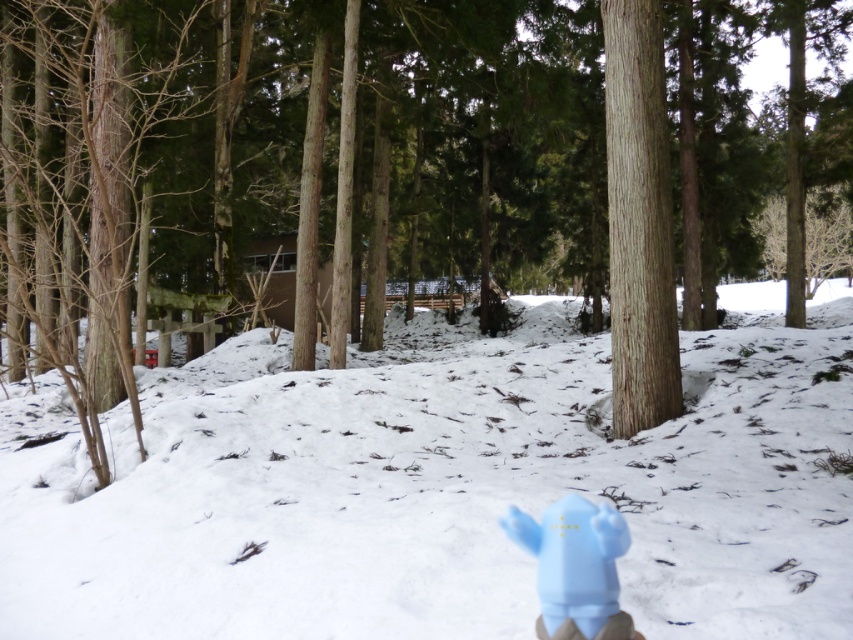
Question: Estimate the real-world distances between objects in this image. Which object is closer to the smooth brown tree trunk at center-right?

Choices:
 (A) white fluffy snow at center
 (B) light blue plastic toy at lower right

Answer: (A)

Question: Which point is farther to the camera?

Choices:
 (A) light blue plastic toy at lower right
 (B) smooth brown tree trunk at center-right
 (C) white fluffy snow at center

Answer: (B)

Question: Is smooth brown tree trunk at center-right thinner than light blue plastic toy at lower right?

Choices:
 (A) no
 (B) yes

Answer: (A)

Question: Is white fluffy snow at center thinner than smooth brown tree trunk at center-right?

Choices:
 (A) no
 (B) yes

Answer: (A)

Question: Which point appears closest to the camera in this image?

Choices:
 (A) (607, 51)
 (B) (628, 621)

Answer: (B)

Question: Observing the image, what is the correct spatial positioning of smooth brown tree trunk at center-right in reference to light blue plastic toy at lower right?

Choices:
 (A) left
 (B) right

Answer: (B)